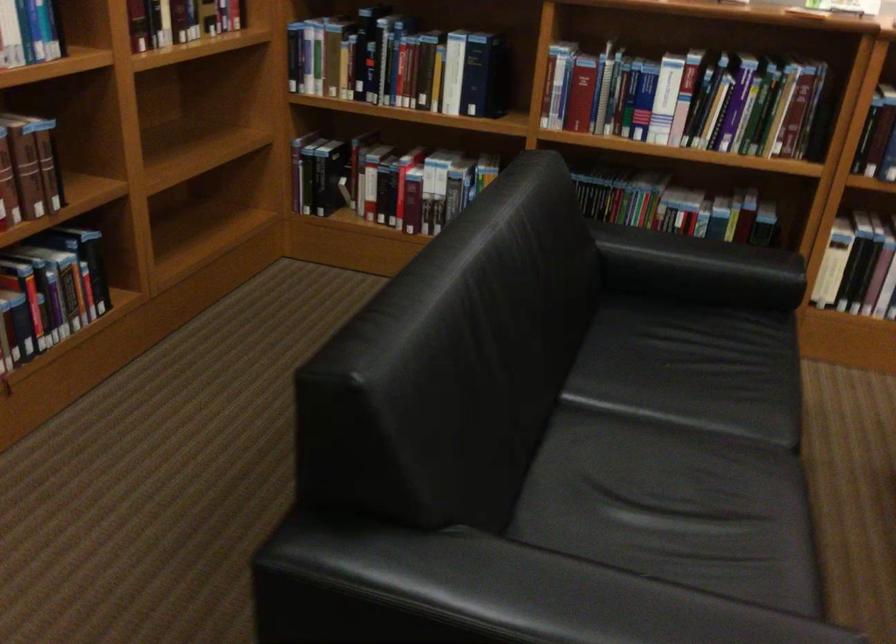
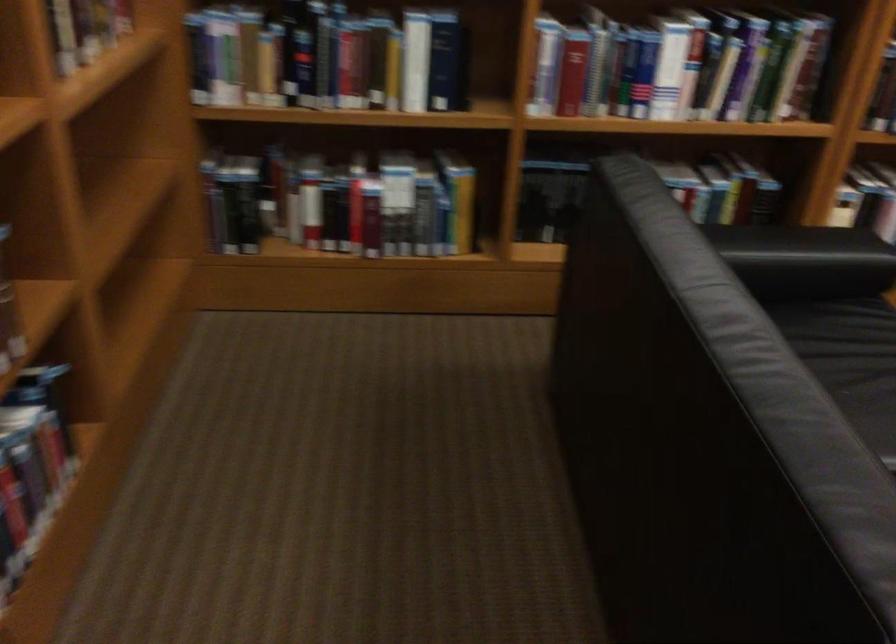
Question: Based on the continuous images, in which direction is the camera rotating? Reply with the corresponding letter.

Choices:
 (A) Left
 (B) Right
 (C) Up
 (D) Down

Answer: (B)